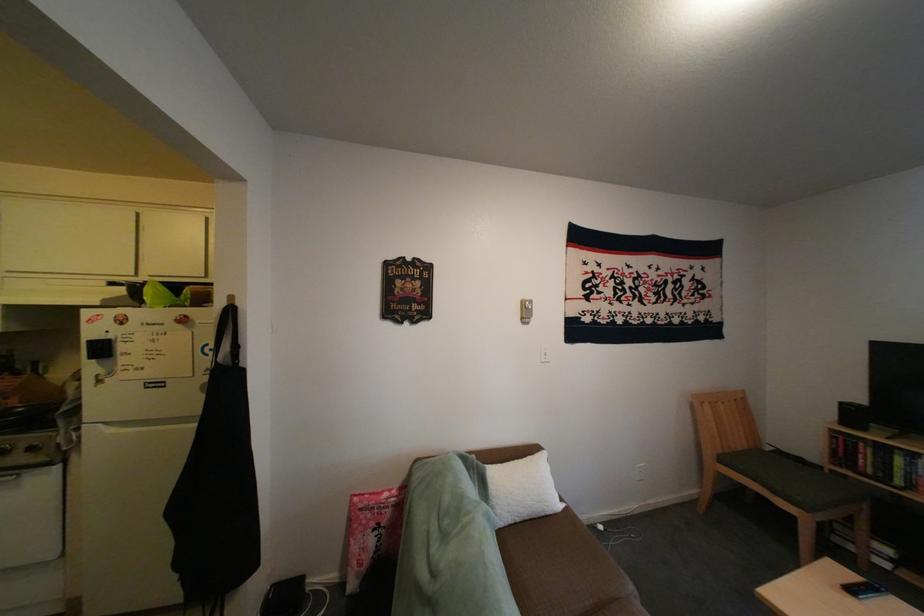
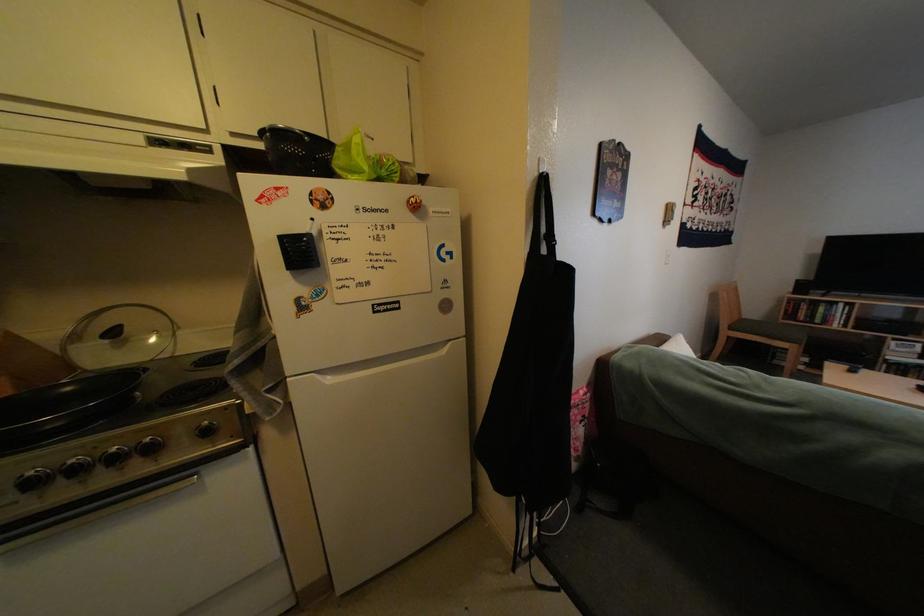
Find the pixel in the second image that matches (x=34, y=411) in the first image.

(80, 392)